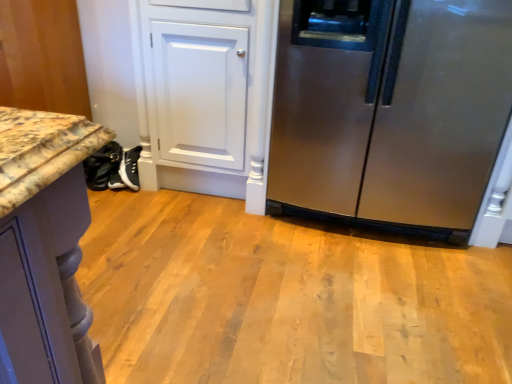
Where is `marble countertop at lower left`? The image size is (512, 384). marble countertop at lower left is located at coordinates (42, 57).

Is stainless steel refrigerator at right bigger or smaller than black leather shoes at lower left?

In the image, stainless steel refrigerator at right appears to be larger than black leather shoes at lower left.

From the image's perspective, between stainless steel refrigerator at right and black leather shoes at lower left, which one is located above?

From the image's view, stainless steel refrigerator at right is above.

Is stainless steel refrigerator at right spatially inside black leather shoes at lower left, or outside of it?

The correct answer is: outside.

Measure the distance from stainless steel refrigerator at right to black leather shoes at lower left.

stainless steel refrigerator at right and black leather shoes at lower left are 4.37 feet apart from each other.

Which is in front, point (66, 1) or point (461, 225)?

Point (461, 225)

Does marble countertop at lower left come in front of stainless steel refrigerator at right?

No, it is behind stainless steel refrigerator at right.

Is marble countertop at lower left to the right of stainless steel refrigerator at right from the viewer's perspective?

No, marble countertop at lower left is not to the right of stainless steel refrigerator at right.

Measure the distance from marble countertop at lower left to stainless steel refrigerator at right.

The distance of marble countertop at lower left from stainless steel refrigerator at right is 1.37 meters.

Identify the location of refrigerator on the right of marble countertop at lower left. The width and height of the screenshot is (512, 384). (393, 111).

Between stainless steel refrigerator at right and marble countertop at lower left, which one is positioned in front?

stainless steel refrigerator at right is closer to the camera.

Could you tell me if stainless steel refrigerator at right is turned towards marble countertop at lower left?

No, stainless steel refrigerator at right does not turn towards marble countertop at lower left.

Is stainless steel refrigerator at right wider than marble countertop at lower left?

Correct, the width of stainless steel refrigerator at right exceeds that of marble countertop at lower left.

From the image's perspective, which one is positioned higher, black leather shoes at lower left or stainless steel refrigerator at right?

stainless steel refrigerator at right.

Is point (112, 141) less distant than point (426, 217)?

No, it is behind (426, 217).

Is black leather shoes at lower left bigger or smaller than stainless steel refrigerator at right?

Considering their sizes, black leather shoes at lower left takes up less space than stainless steel refrigerator at right.

Is black leather shoes at lower left completely or partially outside of stainless steel refrigerator at right?

Absolutely, black leather shoes at lower left is external to stainless steel refrigerator at right.

From their relative heights in the image, would you say marble countertop at lower left is taller or shorter than black leather shoes at lower left?

marble countertop at lower left is taller than black leather shoes at lower left.

What's the angular difference between marble countertop at lower left and black leather shoes at lower left's facing directions?

21.8 degrees.

From the image's perspective, which is above, marble countertop at lower left or black leather shoes at lower left?

marble countertop at lower left is shown above in the image.

Which object is wider, marble countertop at lower left or black leather shoes at lower left?

Wider between the two is marble countertop at lower left.

How different are the orientations of black leather shoes at lower left and marble countertop at lower left in degrees?

They differ by 21.8 degrees in their facing directions.

From the image's perspective, which is below, black leather shoes at lower left or marble countertop at lower left?

black leather shoes at lower left appears lower in the image.

Which object is positioned more to the left, black leather shoes at lower left or marble countertop at lower left?

Positioned to the left is marble countertop at lower left.

Considering the sizes of objects black leather shoes at lower left and marble countertop at lower left in the image provided, who is wider, black leather shoes at lower left or marble countertop at lower left?

With larger width is marble countertop at lower left.

This screenshot has width=512, height=384. Find the location of `footwear that appears below the stainless steel refrigerator at right (from a real-world perspective)`. footwear that appears below the stainless steel refrigerator at right (from a real-world perspective) is located at coordinates (103, 167).

In the image, there is a marble countertop at lower left. Where is `refrigerator below it (from the image's perspective)`? refrigerator below it (from the image's perspective) is located at coordinates (393, 111).

Looking at the image, which one is located further to black leather shoes at lower left, marble countertop at lower left or stainless steel refrigerator at right?

stainless steel refrigerator at right is positioned further to the anchor black leather shoes at lower left.

Based on their spatial positions, is stainless steel refrigerator at right or marble countertop at lower left further from black leather shoes at lower left?

stainless steel refrigerator at right lies further to black leather shoes at lower left than the other object.

Considering their positions, is stainless steel refrigerator at right positioned further to marble countertop at lower left than black leather shoes at lower left?

stainless steel refrigerator at right lies further to marble countertop at lower left than the other object.

Which object lies further to the anchor point stainless steel refrigerator at right, marble countertop at lower left or black leather shoes at lower left?

Based on the image, marble countertop at lower left appears to be further to stainless steel refrigerator at right.

Estimate the real-world distances between objects in this image. Which object is further from marble countertop at lower left, black leather shoes at lower left or stainless steel refrigerator at right?

Based on the image, stainless steel refrigerator at right appears to be further to marble countertop at lower left.

Considering their positions, is black leather shoes at lower left positioned further to stainless steel refrigerator at right than marble countertop at lower left?

marble countertop at lower left.

This screenshot has width=512, height=384. What are the coordinates of `footwear between marble countertop at lower left and stainless steel refrigerator at right in the horizontal direction` in the screenshot? It's located at (103, 167).